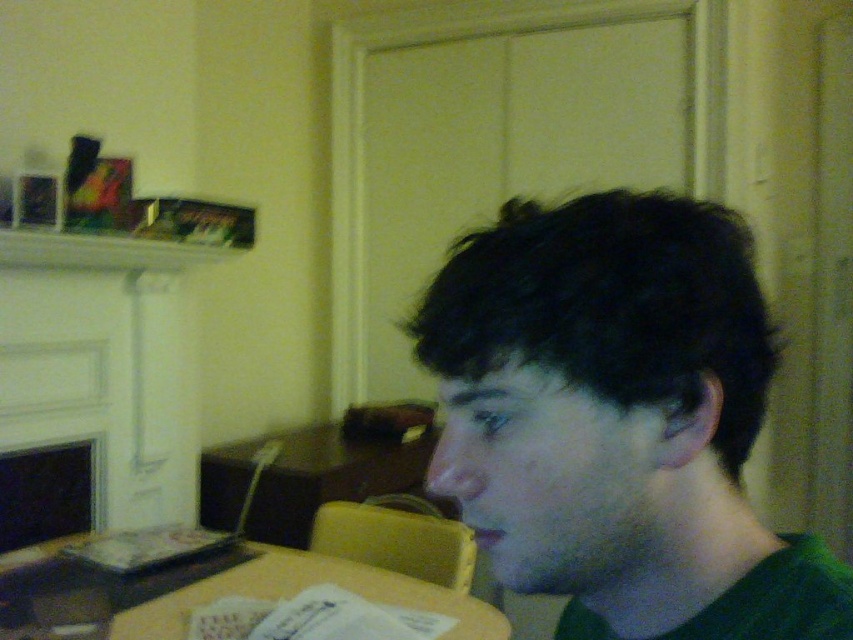
Question: Considering the relative positions of dark green hair at center and wooden table at lower center in the image provided, where is dark green hair at center located with respect to wooden table at lower center?

Choices:
 (A) below
 (B) above

Answer: (B)

Question: Which object is positioned closest to the dark green hair at center?

Choices:
 (A) matte black fireplace at lower left
 (B) wooden table at lower center

Answer: (B)

Question: Is wooden table at lower center thinner than matte black fireplace at lower left?

Choices:
 (A) yes
 (B) no

Answer: (B)

Question: Is dark green hair at center in front of matte black fireplace at lower left?

Choices:
 (A) yes
 (B) no

Answer: (A)

Question: Which point is closer to the camera?

Choices:
 (A) matte black fireplace at lower left
 (B) dark green hair at center
 (C) wooden table at lower center

Answer: (B)

Question: Among these objects, which one is farthest from the camera?

Choices:
 (A) matte black fireplace at lower left
 (B) dark green hair at center

Answer: (A)